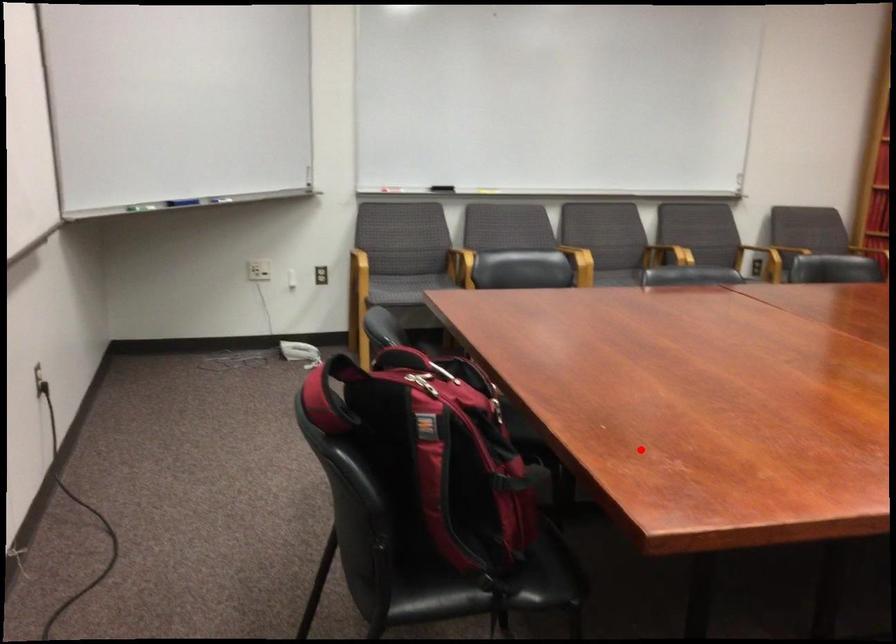
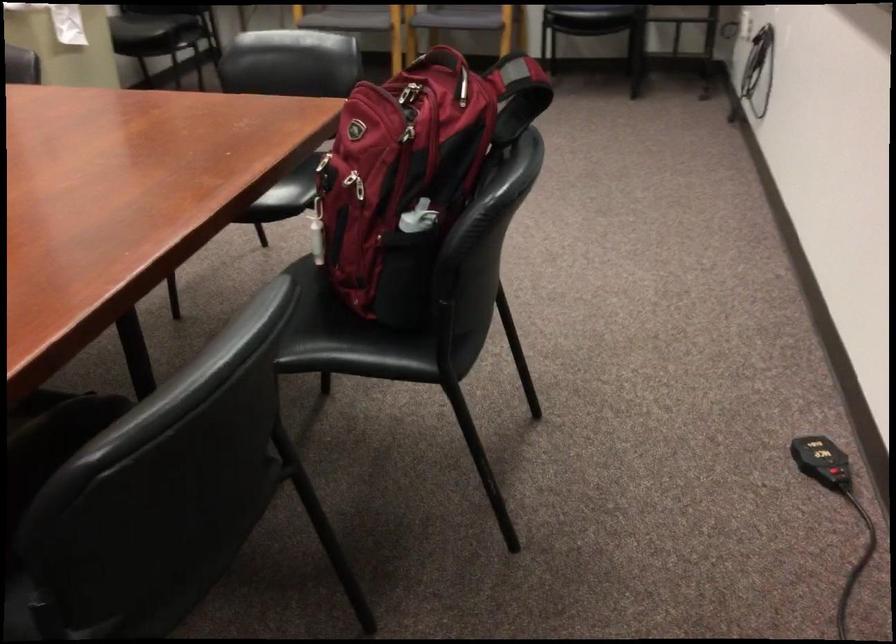
Locate, in the second image, the point that corresponds to the highlighted location in the first image.

(314, 153)